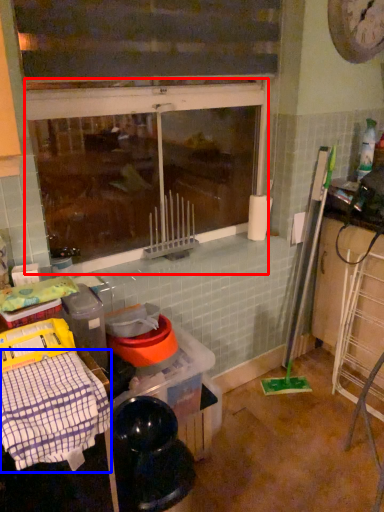
Question: Which point is further to the camera, window (highlighted by a red box) or blanket (highlighted by a blue box)?

Choices:
 (A) window
 (B) blanket

Answer: (A)